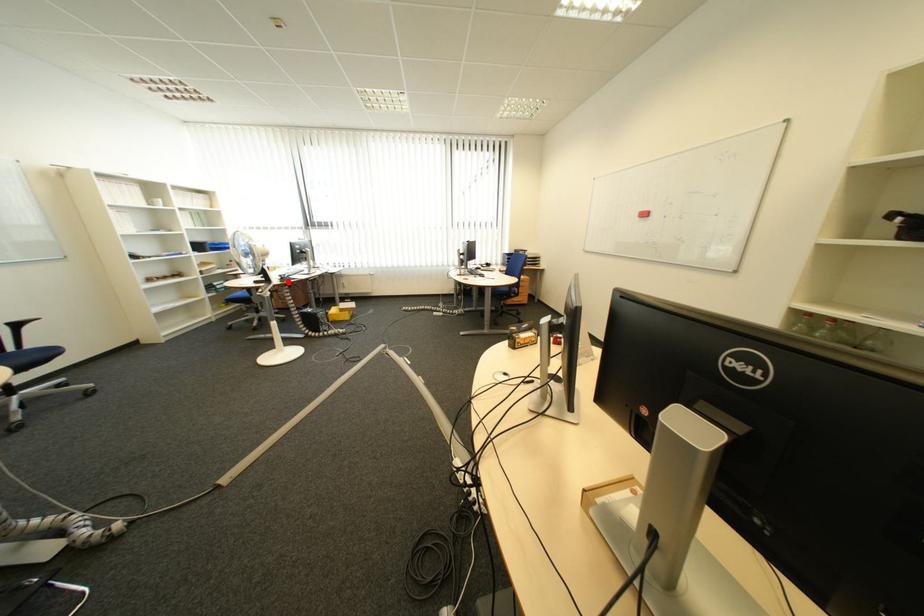
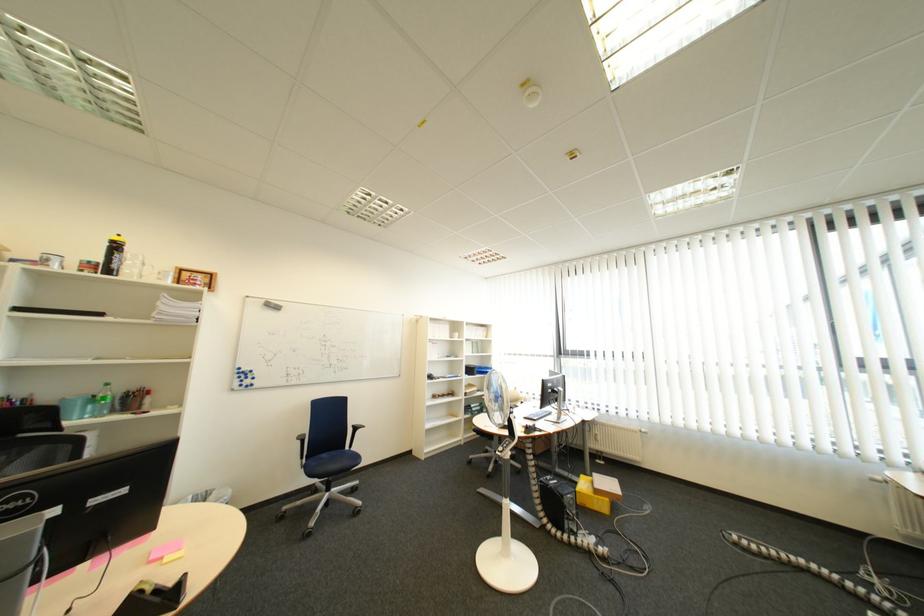
Question: I am providing you with two images of the same scene from different viewpoints. Given a red point in image1, look at the same physical point in image2. Is it:

Choices:
 (A) Closer to the viewpoint
 (B) Farther from the viewpoint

Answer: (B)